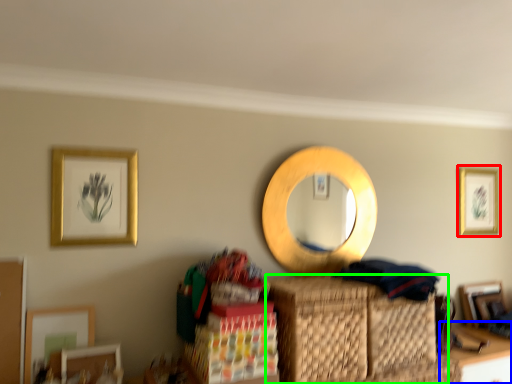
Question: Which object is the closest to the picture frame (highlighted by a red box)? Choose among these: table (highlighted by a blue box) or basket (highlighted by a green box).

Choices:
 (A) table
 (B) basket

Answer: (A)